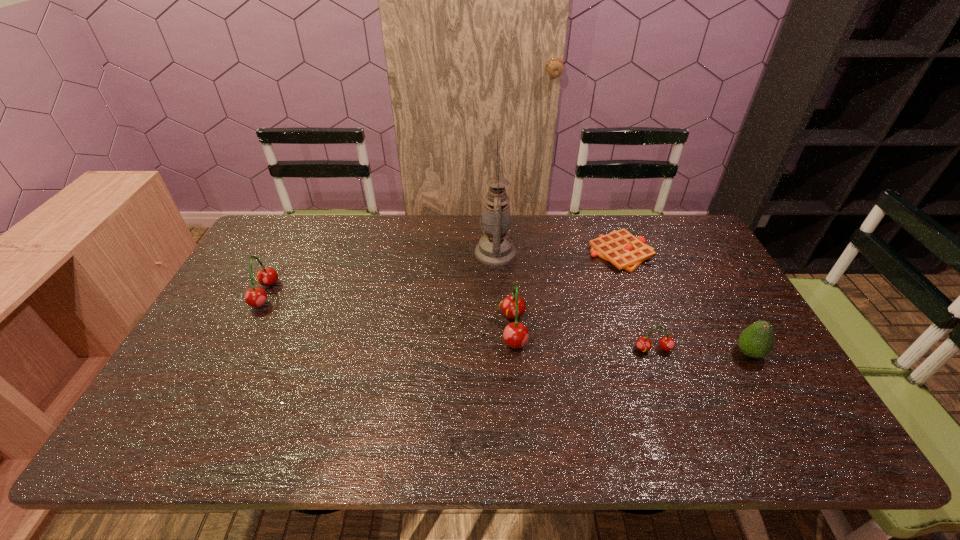
This screenshot has height=540, width=960. I want to click on location for an additional cherry to make spacing equal, so click(x=384, y=311).